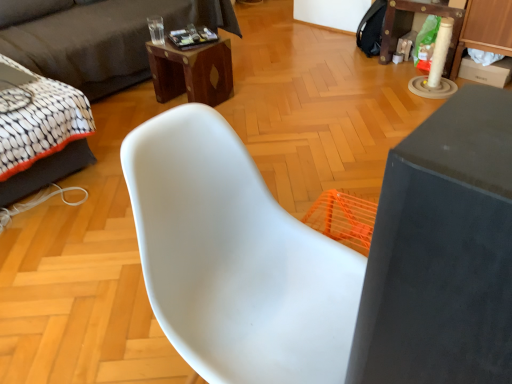
Question: Is matte gray table at right, the 1th table in the front-to-back sequence, beside dark gray fabric couch at upper left?

Choices:
 (A) no
 (B) yes

Answer: (A)

Question: Can you confirm if matte gray table at right, marked as the 2th table in a back-to-front arrangement, is wider than dark gray fabric couch at upper left?

Choices:
 (A) no
 (B) yes

Answer: (A)

Question: Is matte gray table at right, the first table viewed from the left, thinner than dark gray fabric couch at upper left?

Choices:
 (A) no
 (B) yes

Answer: (B)

Question: Is matte gray table at right, the second table in the right-to-left sequence, oriented away from dark gray fabric couch at upper left?

Choices:
 (A) yes
 (B) no

Answer: (B)

Question: Is matte gray table at right, the 1th table in the front-to-back sequence, shorter than dark gray fabric couch at upper left?

Choices:
 (A) yes
 (B) no

Answer: (B)

Question: Looking at their shapes, would you say white fabric bed at left is wider or thinner than matte gray table at right, the second table in the right-to-left sequence?

Choices:
 (A) thin
 (B) wide

Answer: (B)

Question: Based on their sizes in the image, would you say white fabric bed at left is bigger or smaller than matte gray table at right, the second table in the right-to-left sequence?

Choices:
 (A) small
 (B) big

Answer: (B)

Question: From the image's perspective, relative to matte gray table at right, the 1th table in the front-to-back sequence, is white fabric bed at left above or below?

Choices:
 (A) below
 (B) above

Answer: (B)

Question: Would you say white fabric bed at left is inside or outside matte gray table at right, the 1th table in the front-to-back sequence?

Choices:
 (A) inside
 (B) outside

Answer: (B)

Question: In the image, is wooden desk at upper center on the left side or the right side of dark gray fabric couch at upper left?

Choices:
 (A) right
 (B) left

Answer: (A)

Question: Relative to dark gray fabric couch at upper left, is wooden desk at upper center in front or behind?

Choices:
 (A) front
 (B) behind

Answer: (B)

Question: From a real-world perspective, is wooden desk at upper center positioned above or below dark gray fabric couch at upper left?

Choices:
 (A) above
 (B) below

Answer: (B)

Question: Is wooden desk at upper center bigger or smaller than dark gray fabric couch at upper left?

Choices:
 (A) big
 (B) small

Answer: (B)

Question: Do you think wooden desk at upper center is within white plastic chair at center, or outside of it?

Choices:
 (A) inside
 (B) outside

Answer: (B)

Question: Is wooden desk at upper center bigger or smaller than white plastic chair at center?

Choices:
 (A) big
 (B) small

Answer: (B)